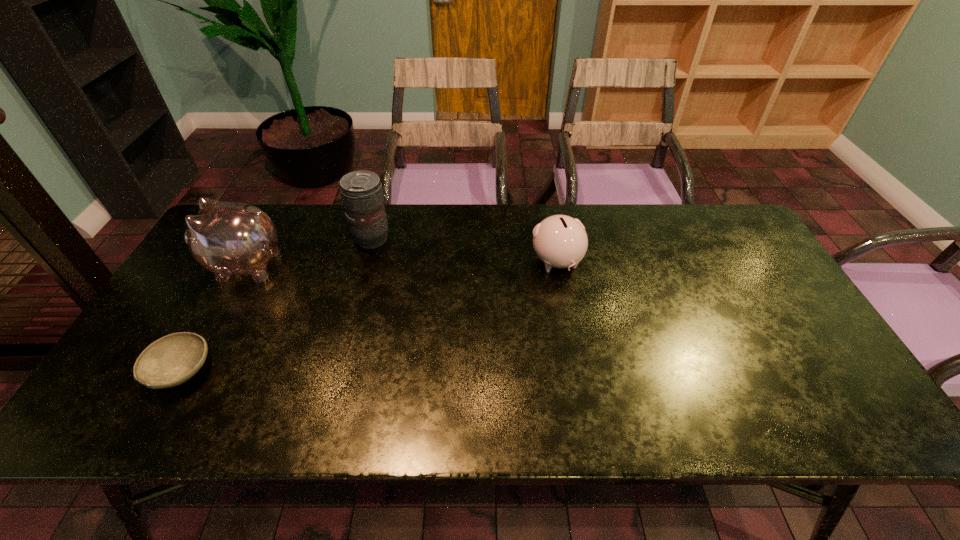
Image resolution: width=960 pixels, height=540 pixels. Identify the location of free space between the nearest object and the third object from left to right. (276, 305).

Locate an element on the screen. The width and height of the screenshot is (960, 540). vacant space in between the shorter piggy bank and the taller piggy bank is located at coordinates (401, 264).

At what (x,y) coordinates should I click in order to perform the action: click on free point between the bowl and the taller piggy bank. Please return your answer as a coordinate pair (x, y). The width and height of the screenshot is (960, 540). Looking at the image, I should click on (213, 319).

In order to click on vacant space that is in between the taller piggy bank and the shorter piggy bank in this screenshot , I will do `click(401, 264)`.

Find the location of a particular element. free spot between the rightmost object and the second object from right to left is located at coordinates (465, 251).

You are a GUI agent. You are given a task and a screenshot of the screen. Output one action in this format:
    pyautogui.click(x=<x>, y=<y>)
    Task: Click on the vacant area that lies between the nearest object and the second shortest object
    
    Given the screenshot: What is the action you would take?
    pyautogui.click(x=369, y=317)

Image resolution: width=960 pixels, height=540 pixels. I want to click on free space between the second object from right to left and the second shortest object, so click(x=465, y=251).

At what (x,y) coordinates should I click in order to perform the action: click on free spot between the shortest object and the left piggy bank. Please return your answer as a coordinate pair (x, y). This screenshot has width=960, height=540. Looking at the image, I should click on (213, 319).

Identify the location of object that stands as the third closest to the nearest object. (560, 241).

Select which object is the third closest to the taller piggy bank. Please provide its 2D coordinates. Your answer should be formatted as a tuple, i.e. [(x, y)], where the tuple contains the x and y coordinates of a point satisfying the conditions above.

[(560, 241)]